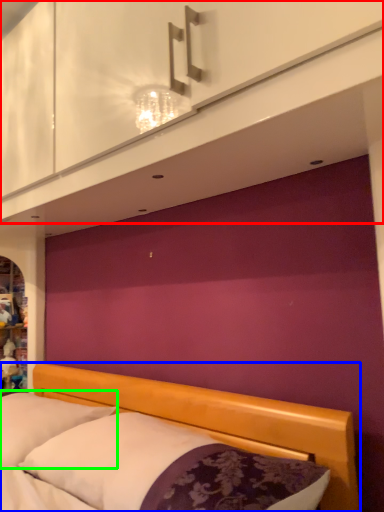
Question: Estimate the real-world distances between objects in this image. Which object is farther from dresser (highlighted by a red box), bed (highlighted by a blue box) or pillow (highlighted by a green box)?

Choices:
 (A) bed
 (B) pillow

Answer: (B)